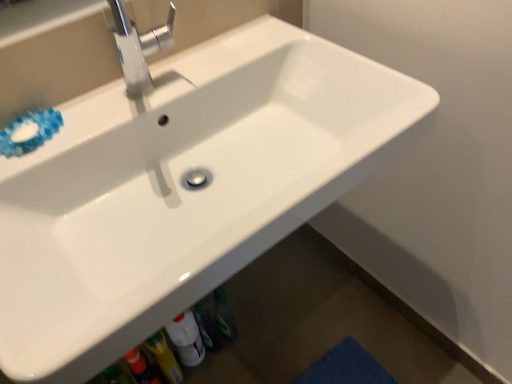
At what (x,y) coordinates should I click in order to perform the action: click on free location to the right of polished metallic faucet at upper center. Please return your answer as a coordinate pair (x, y). The height and width of the screenshot is (384, 512). Looking at the image, I should click on (226, 63).